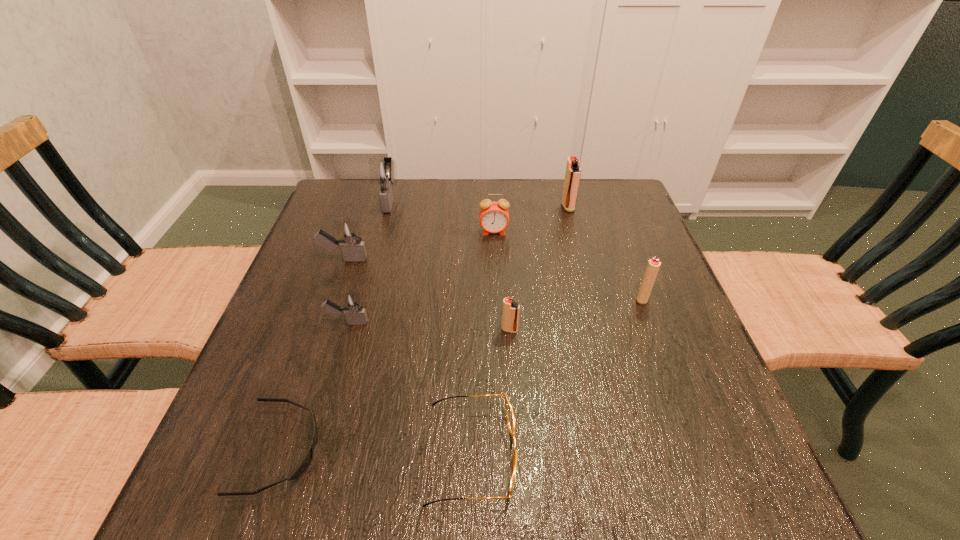
Where is `the second igniter from right to left`? This screenshot has height=540, width=960. the second igniter from right to left is located at coordinates (573, 173).

In order to click on the farthest red igniter in this screenshot , I will do `click(573, 173)`.

Find the location of `the farthest gray igniter`. the farthest gray igniter is located at coordinates (382, 171).

Identify the location of the second farthest gray igniter. This screenshot has width=960, height=540. (353, 249).

This screenshot has height=540, width=960. I want to click on the third farthest igniter, so click(353, 249).

Locate an element on the screen. This screenshot has height=540, width=960. the second nearest red igniter is located at coordinates point(653,266).

Locate an element on the screen. The height and width of the screenshot is (540, 960). the rightmost object is located at coordinates (653, 266).

You are a GUI agent. You are given a task and a screenshot of the screen. Output one action in this format:
    pyautogui.click(x=<x>, y=<y>)
    Task: Click on the pink alarm clock
    
    Given the screenshot: What is the action you would take?
    pyautogui.click(x=494, y=216)

This screenshot has width=960, height=540. I want to click on alarm clock, so click(x=494, y=216).

The width and height of the screenshot is (960, 540). In order to click on the nearest red igniter in this screenshot , I will do `click(510, 317)`.